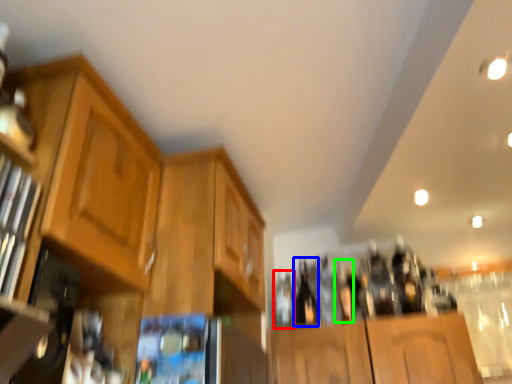
Question: Which object is the farthest from bottle (highlighted by a red box)? Choose among these: beer bottle (highlighted by a blue box) or bottle (highlighted by a green box).

Choices:
 (A) beer bottle
 (B) bottle

Answer: (B)